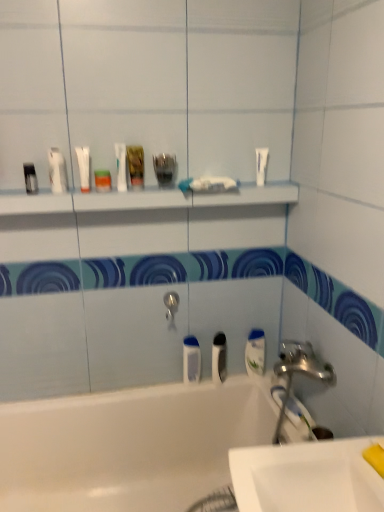
Question: Would you say white matte tube at upper left, the 2th toiletry positioned from the left, is inside or outside silver metallic tap at center?

Choices:
 (A) outside
 (B) inside

Answer: (A)

Question: In terms of width, does white matte tube at upper left, the second toiletry when ordered from right to left, look wider or thinner when compared to silver metallic tap at center?

Choices:
 (A) thin
 (B) wide

Answer: (A)

Question: Which object is the closest to the white glossy mouthwash at right, which is the 3th mouthwash in top-to-bottom order?

Choices:
 (A) silver metallic tap at center
 (B) matte black container at upper left, acting as the 3th toiletry starting from the right
 (C) white matte toothpaste at center, which ranks as the 1th toothpaste in left-to-right order
 (D) metallic silver container at center, the third toiletry from the left
 (E) white glossy shelf at upper center

Answer: (A)

Question: Which of these objects is positioned farthest from the white matte tube at upper right, arranged as the first toothpaste when viewed from the right?

Choices:
 (A) white glossy tube at upper center, acting as the 2th mouthwash starting from the top
 (B) white glossy shelf at upper center
 (C) white glossy sink at lower right
 (D) white glossy bathtub at lower left
 (E) white glossy mouthwash at right, placed as the fifth mouthwash when sorted from left to right

Answer: (D)